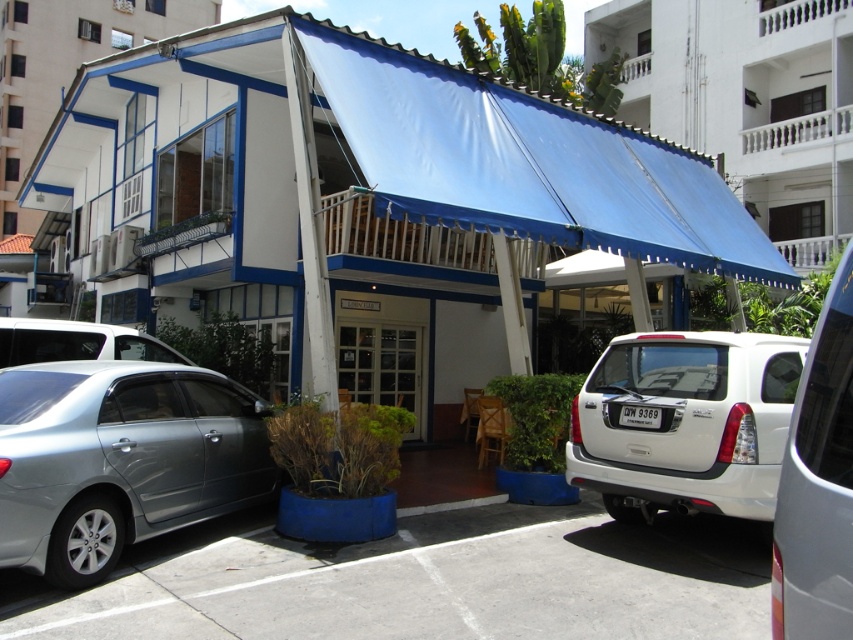
Question: Which point is farther from the camera taking this photo?

Choices:
 (A) (773, 96)
 (B) (67, 390)
 (C) (572, 248)
 (D) (820, 620)

Answer: (A)

Question: Does gray concrete parking lot at lower left come behind blue fabric awning at upper center?

Choices:
 (A) yes
 (B) no

Answer: (B)

Question: Does white matte building at center appear over white matte suv at right?

Choices:
 (A) no
 (B) yes

Answer: (B)

Question: Is the position of white matte building at center more distant than that of blue fabric awning at upper center?

Choices:
 (A) yes
 (B) no

Answer: (B)

Question: Based on their relative distances, which object is nearer to the white matte suv at right?

Choices:
 (A) satin silver sedan at left
 (B) blue fabric awning at upper center
 (C) blue fabric awning at center

Answer: (A)

Question: Which point is closer to the camera?

Choices:
 (A) (482, 554)
 (B) (788, 538)
 (C) (120, 490)
 (D) (734, 148)

Answer: (B)